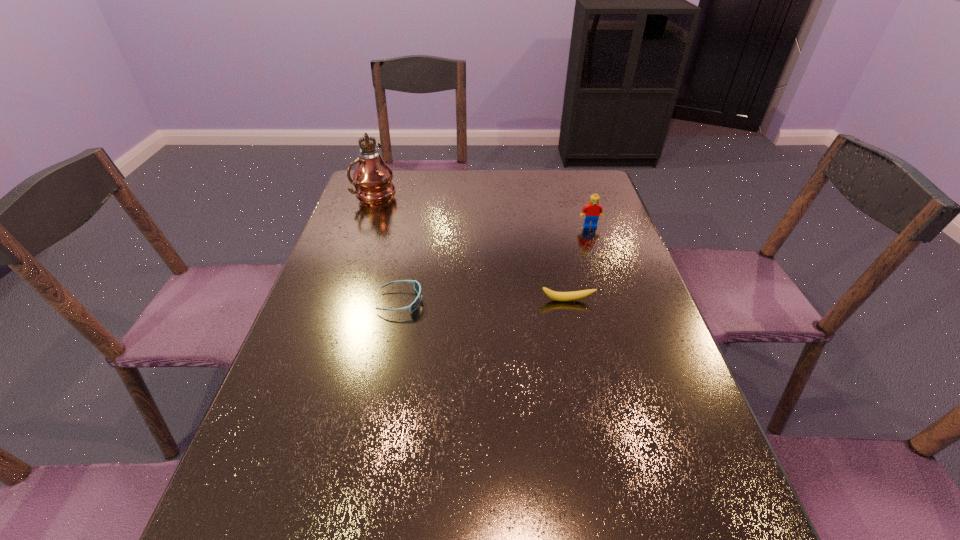
I want to click on the leftmost object, so [x=372, y=177].

Where is `the farthest object`? Image resolution: width=960 pixels, height=540 pixels. the farthest object is located at coordinates (372, 177).

Locate an element on the screen. The height and width of the screenshot is (540, 960). Lego is located at coordinates (593, 210).

This screenshot has width=960, height=540. Identify the location of the third shortest object. (593, 210).

Find the location of a particular element. The image size is (960, 540). banana is located at coordinates (575, 295).

Where is `the third object from left to right`? The image size is (960, 540). the third object from left to right is located at coordinates (575, 295).

You are a GUI agent. You are given a task and a screenshot of the screen. Output one action in this format:
    pyautogui.click(x=<x>, y=<y>)
    Task: Click on the shortest object
    The image size is (960, 540).
    Given the screenshot: What is the action you would take?
    pyautogui.click(x=417, y=287)

Identify the location of goggles. (417, 287).

Locate an element on the screen. free region located 0.260m on the front of the oil lamp is located at coordinates (353, 254).

Find the location of a particular element. free space located on the face of the rightmost object is located at coordinates [x=622, y=324].